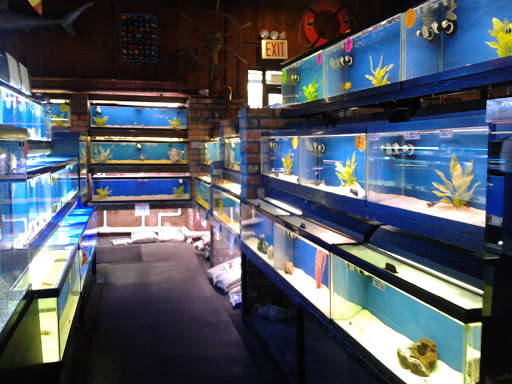
Find the location of `black shelf`. black shelf is located at coordinates pos(25,331).